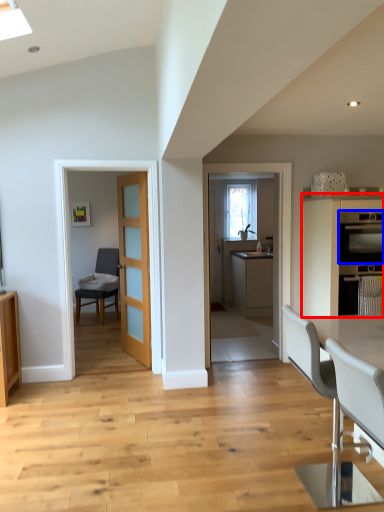
Question: Which object is closer to the camera taking this photo, cabinetry (highlighted by a red box) or kitchen appliance (highlighted by a blue box)?

Choices:
 (A) cabinetry
 (B) kitchen appliance

Answer: (A)